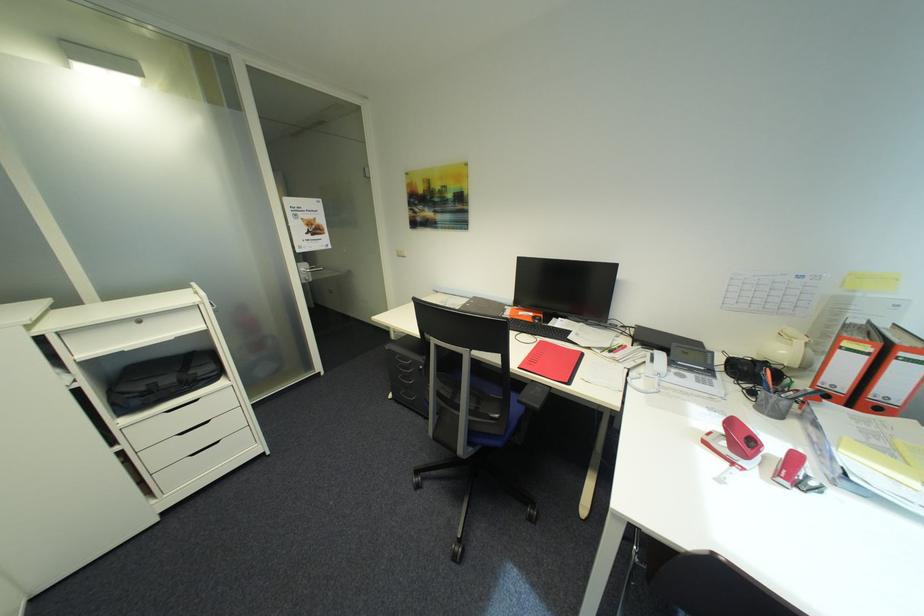
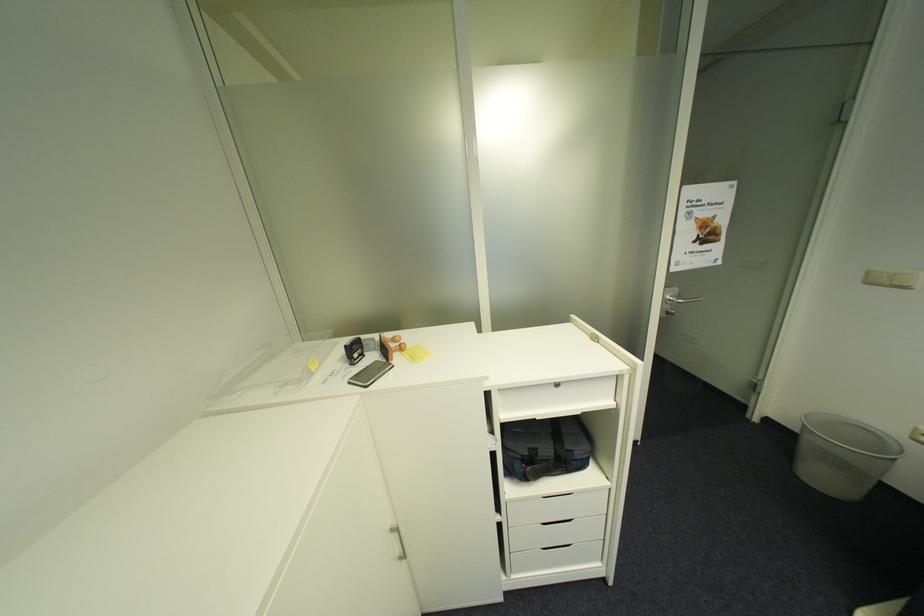
In the second image, find the point that corresponds to point 311,272 in the first image.

(676, 301)